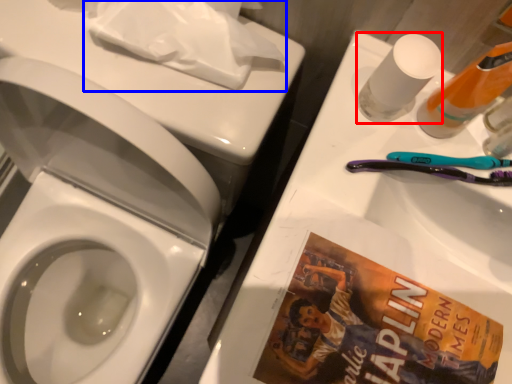
Question: Among these objects, which one is farthest to the camera, mouthwash (highlighted by a red box) or toilet paper (highlighted by a blue box)?

Choices:
 (A) mouthwash
 (B) toilet paper

Answer: (B)